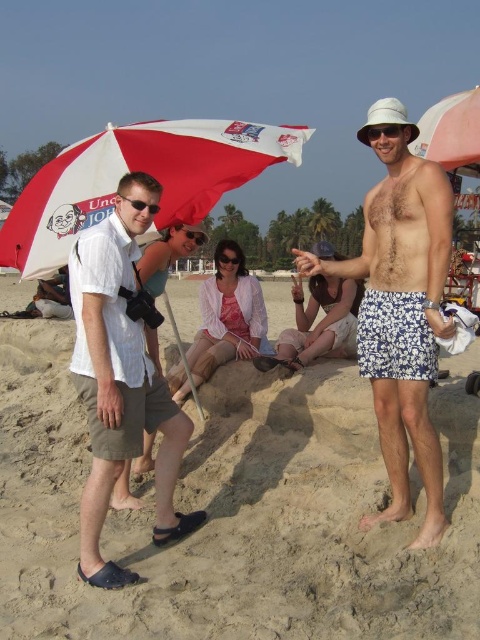
In the scene shown: You are standing at the point marked as point (x=402, y=310) in the image. Looking around, you see white floral shorts at center. Which direction should you face to see the person wearing a white bucket hat and patterned blue and white swim trunks?

Result: You should face towards the right to see the person wearing a white bucket hat and patterned blue and white swim trunks because the person is on the right side of the image.

You are standing at the camera position and want to walk to both points. Which point should you reach first, point (291, 568) or point (216, 259)?

You should reach point (291, 568) first because it is closer to the camera than point (216, 259).